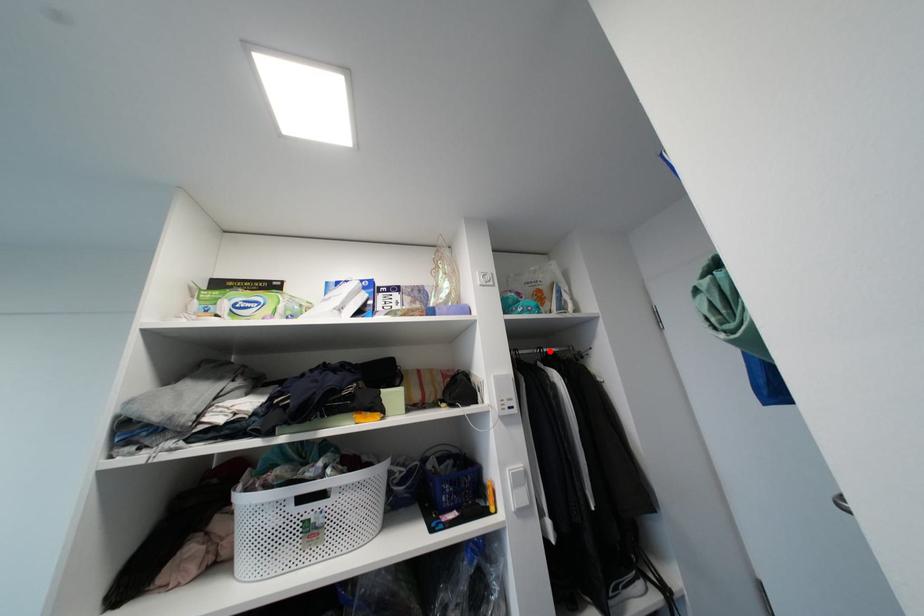
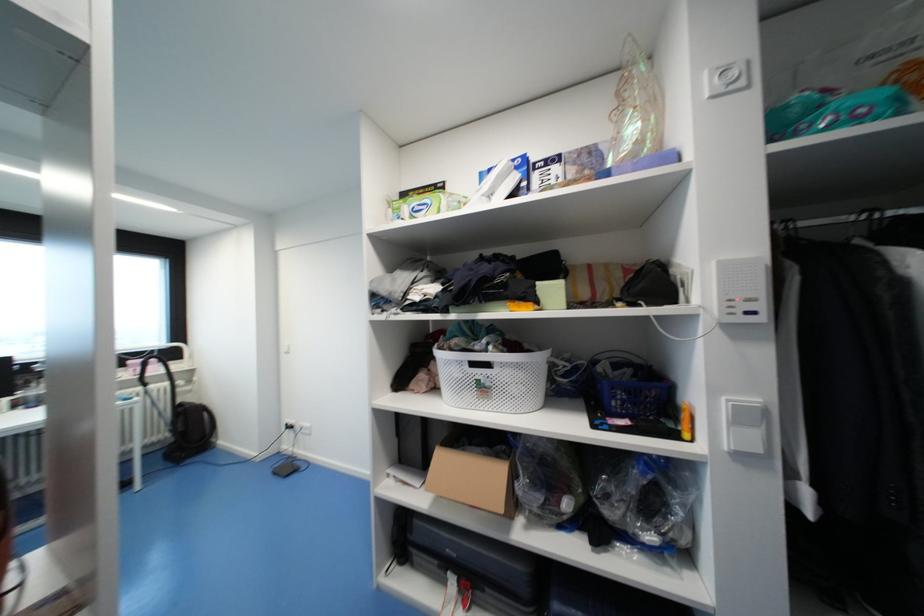
Find the pixel in the second image that matches the highlighted location in the first image.

(895, 214)